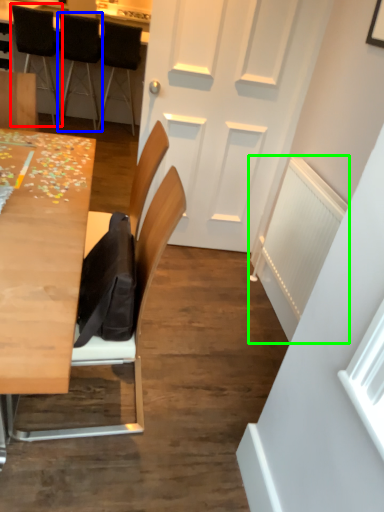
Question: Estimate the real-world distances between objects in this image. Which object is farther from chair (highlighted by a red box), chair (highlighted by a blue box) or radiator (highlighted by a green box)?

Choices:
 (A) chair
 (B) radiator

Answer: (B)